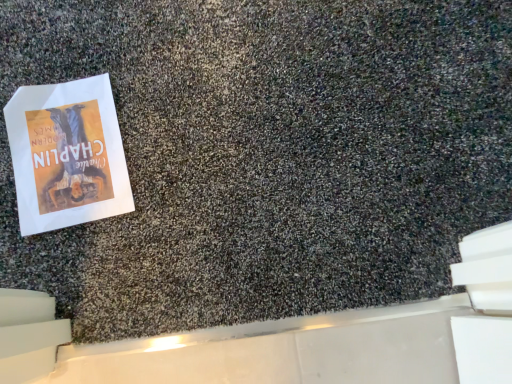
The height and width of the screenshot is (384, 512). What do you see at coordinates (67, 155) in the screenshot?
I see `white paper poster at left` at bounding box center [67, 155].

Locate an element on the screen. Image resolution: width=512 pixels, height=384 pixels. white paper poster at left is located at coordinates (67, 155).

I want to click on white paper poster at left, so click(67, 155).